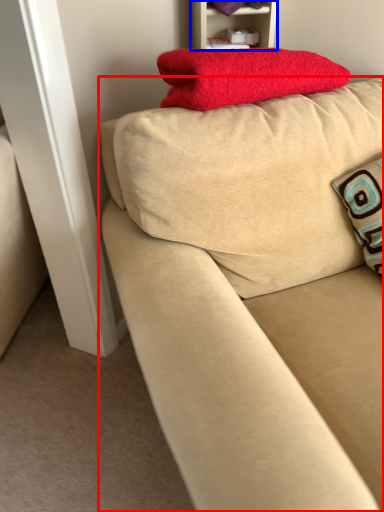
Question: Among these objects, which one is nearest to the camera, studio couch (highlighted by a red box) or furniture (highlighted by a blue box)?

Choices:
 (A) studio couch
 (B) furniture

Answer: (A)